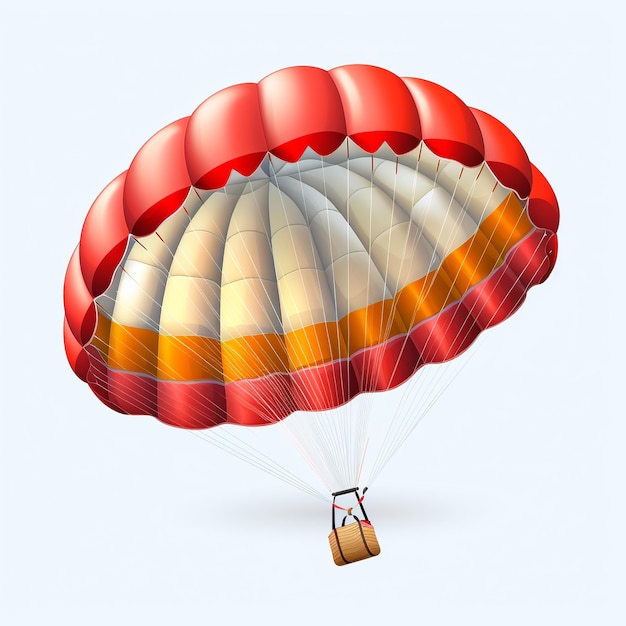
Where is `cable`? cable is located at coordinates (432, 394).